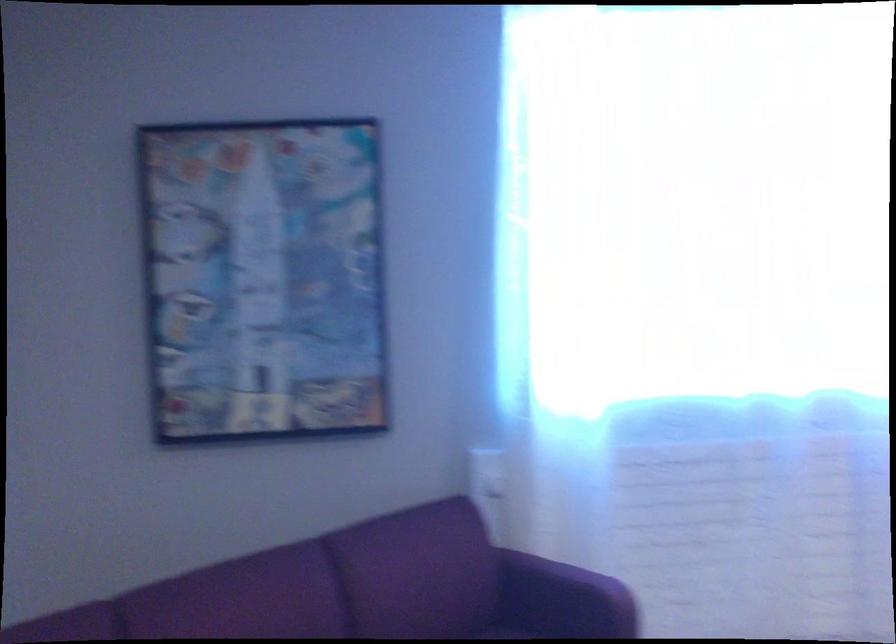
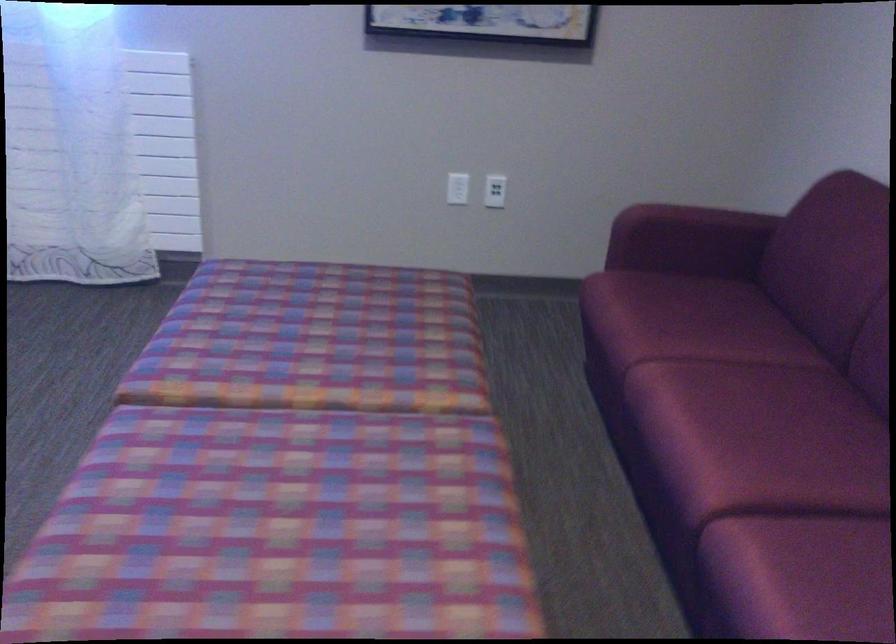
Question: What movement of the cameraman would produce the second image?

Choices:
 (A) Left
 (B) Right
 (C) Forward
 (D) Backward

Answer: (B)